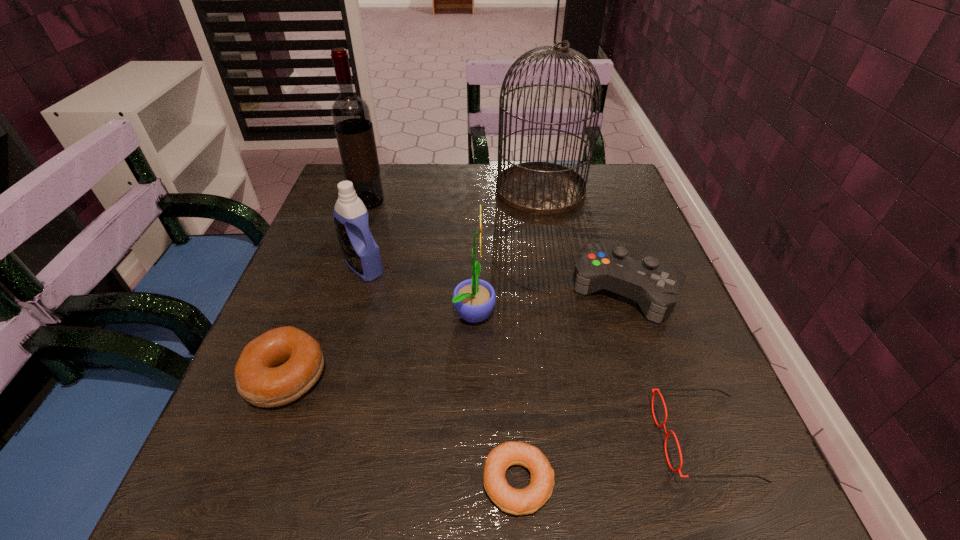
Locate an element on the screen. free space that satisfies the following two spatial constraints: 1. on the front side of the wine bottle; 2. on the right side of the control is located at coordinates (339, 290).

Where is `free space that satisfies the following two spatial constraints: 1. on the front-facing side of the nearer bagel; 2. on the right side of the sunflower`? free space that satisfies the following two spatial constraints: 1. on the front-facing side of the nearer bagel; 2. on the right side of the sunflower is located at coordinates (472, 482).

Where is `free spot that satisfies the following two spatial constraints: 1. on the front side of the right bagel; 2. on the right side of the third shortest object`? free spot that satisfies the following two spatial constraints: 1. on the front side of the right bagel; 2. on the right side of the third shortest object is located at coordinates (246, 482).

This screenshot has width=960, height=540. I want to click on free space that satisfies the following two spatial constraints: 1. on the front-facing side of the sunflower; 2. on the right side of the shortest object, so click(472, 482).